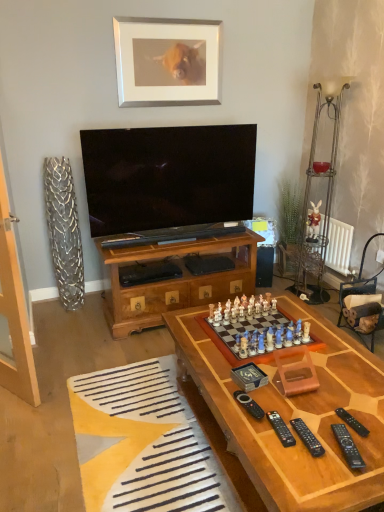
At what (x,y) coordinates should I click in order to perform the action: click on vacant space behind black plastic remote at lower right, the third remote in the left-to-right sequence. Please return your answer as a coordinate pair (x, y). This screenshot has height=512, width=384. Looking at the image, I should click on (297, 408).